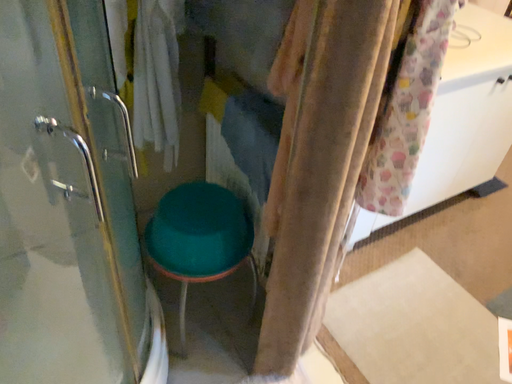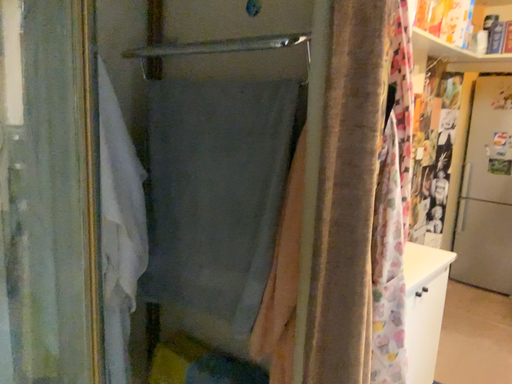
Question: Which way did the camera rotate in the video?

Choices:
 (A) rotated left
 (B) rotated right

Answer: (B)